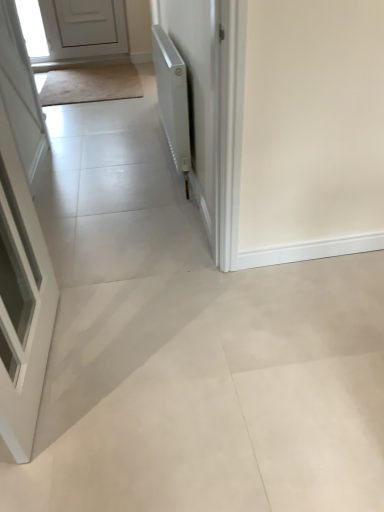
Question: Is beige carpet at upper left bigger or smaller than white matte radiator at upper right?

Choices:
 (A) big
 (B) small

Answer: (B)

Question: In terms of height, does beige carpet at upper left look taller or shorter compared to white matte radiator at upper right?

Choices:
 (A) short
 (B) tall

Answer: (A)

Question: Which object is positioned closest to the white matte radiator at upper right?

Choices:
 (A) white glossy door at left, which is counted as the first door, starting from the front
 (B) beige carpet at upper left
 (C) white matte door at upper left, acting as the first door starting from the top

Answer: (A)

Question: Which is farther from the white matte radiator at upper right?

Choices:
 (A) white glossy door at left, placed as the first door when sorted from bottom to top
 (B) beige carpet at upper left
 (C) white matte door at upper left, placed as the first door when sorted from back to front

Answer: (C)